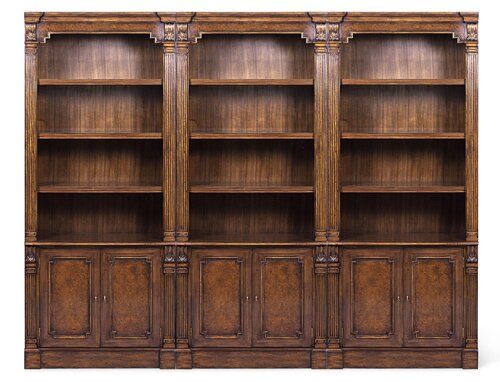
This screenshot has height=382, width=500. Identify the location of shelves on cabinet. (x=125, y=80), (x=132, y=134), (x=133, y=176), (x=241, y=194), (x=263, y=136), (x=269, y=80), (x=385, y=72), (x=392, y=132), (x=400, y=184).